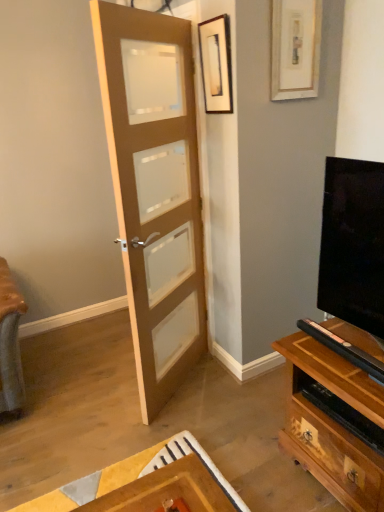
Identify the location of free point to the right of matte wood door at center. (229, 390).